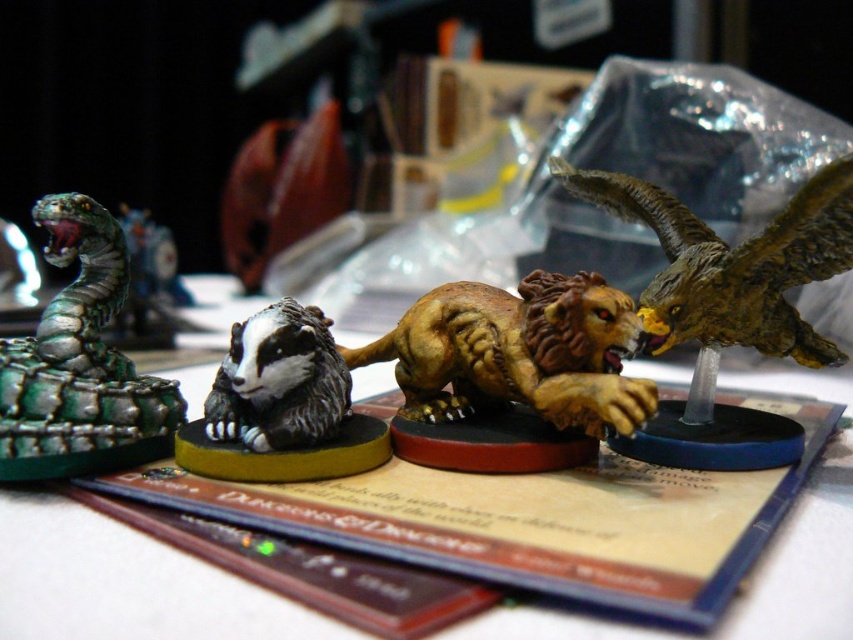
Question: Can you confirm if green metallic snake at left is positioned below black matte badger at center?

Choices:
 (A) yes
 (B) no

Answer: (B)

Question: Which object is farther from the camera taking this photo?

Choices:
 (A) shiny gold eagle at upper right
 (B) green metallic snake at left
 (C) golden textured lion at center

Answer: (B)

Question: Which of the following is the farthest from the observer?

Choices:
 (A) shiny gold eagle at upper right
 (B) black matte badger at center
 (C) golden textured lion at center

Answer: (A)

Question: Is golden textured lion at center wider than green metallic snake at left?

Choices:
 (A) yes
 (B) no

Answer: (A)

Question: Based on their relative distances, which object is nearer to the golden textured lion at center?

Choices:
 (A) shiny gold eagle at upper right
 (B) black matte badger at center

Answer: (B)

Question: Can you confirm if green metallic snake at left is smaller than black matte badger at center?

Choices:
 (A) yes
 (B) no

Answer: (B)